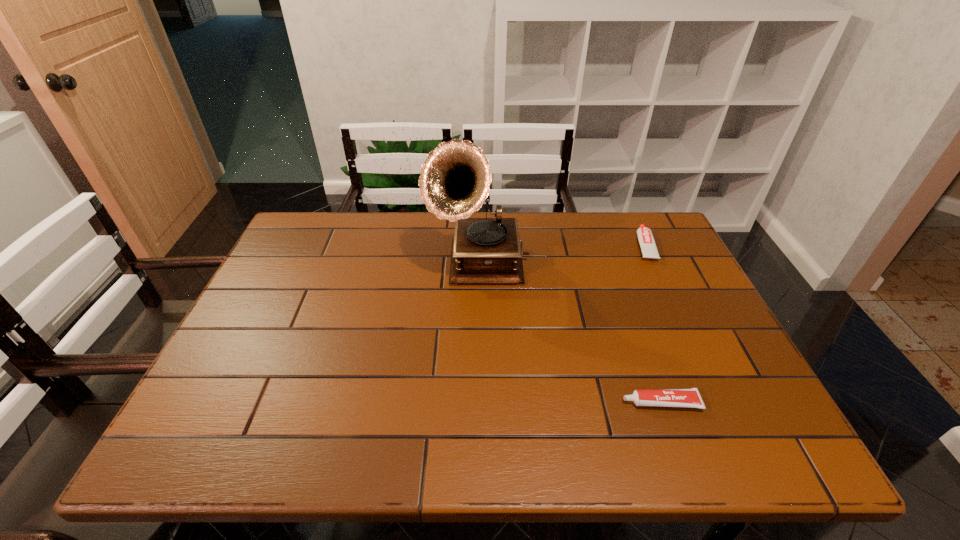
Identify the location of record player. (454, 182).

The image size is (960, 540). I want to click on the leftmost object, so click(454, 182).

The width and height of the screenshot is (960, 540). I want to click on the farther toothpaste, so click(x=646, y=240).

Where is `the right toothpaste`? The image size is (960, 540). the right toothpaste is located at coordinates (646, 240).

Identify the location of the left toothpaste. This screenshot has height=540, width=960. (690, 397).

Where is `the nearer toothpaste`? the nearer toothpaste is located at coordinates (690, 397).

Locate an element on the screen. free space located on the horn of the tallest object is located at coordinates (478, 397).

The height and width of the screenshot is (540, 960). I want to click on vacant space located 0.270m on the left of the rightmost object, so (x=544, y=246).

Where is `vacant area situated at the nozzle of the left toothpaste`? This screenshot has height=540, width=960. vacant area situated at the nozzle of the left toothpaste is located at coordinates (502, 402).

I want to click on vacant position located 0.210m at the nozzle of the left toothpaste, so click(x=521, y=402).